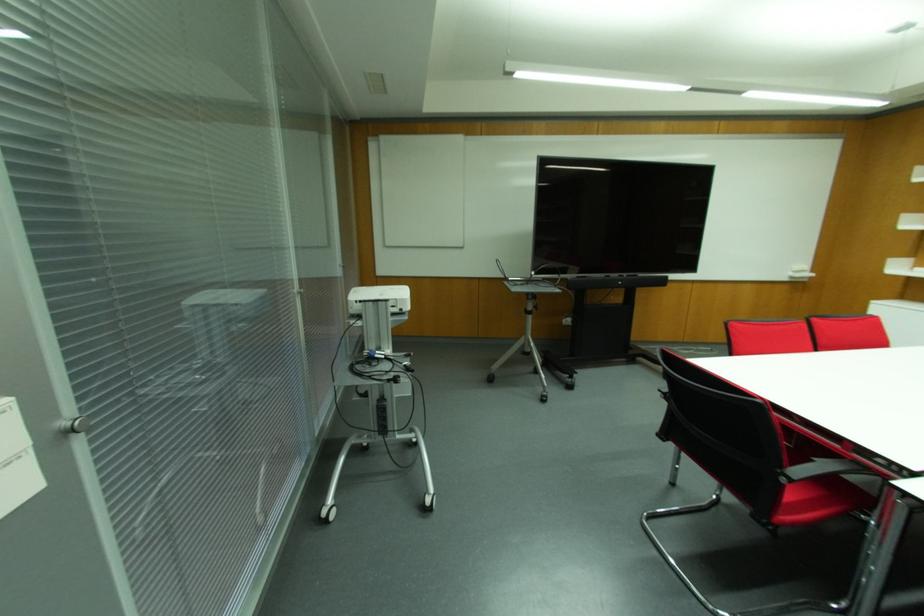
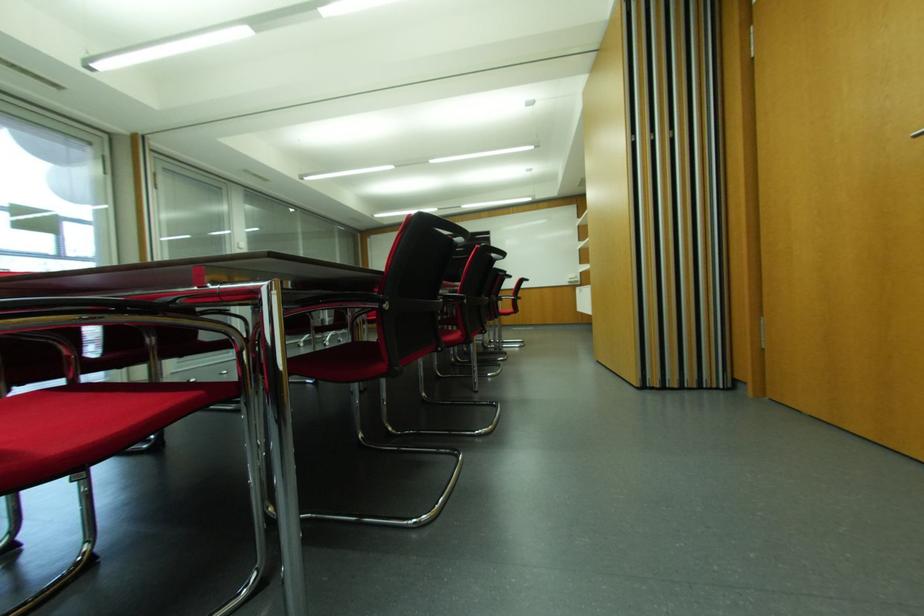
Question: I am providing you with two images of the same scene from different viewpoints. Which of the following objects are not visible in image2?

Choices:
 (A) silver door handle
 (B) red chair sitting surface
 (C) pink sticky notes
 (D) silver blind knob

Answer: (D)